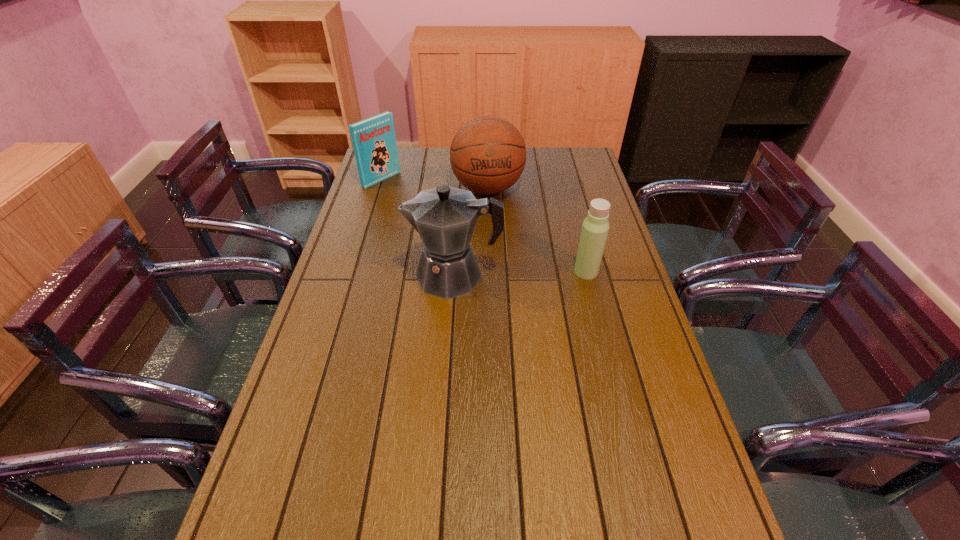
Where is `vacant area at the near edge of the desktop`? This screenshot has height=540, width=960. vacant area at the near edge of the desktop is located at coordinates (375, 493).

In the image, there is a desktop. Where is `blank space at the left edge`? This screenshot has width=960, height=540. blank space at the left edge is located at coordinates (390, 197).

Find the location of a particular element. The width and height of the screenshot is (960, 540). blank area at the right edge is located at coordinates [581, 218].

The width and height of the screenshot is (960, 540). Find the location of `vacant space at the far right corner`. vacant space at the far right corner is located at coordinates (550, 156).

Find the location of a particular element. free space at the near right corner of the desktop is located at coordinates (665, 521).

Identify the location of vacant space in between the rightmost object and the leftmost object. (484, 226).

Identify the location of free space between the thermos bottle and the basketball. This screenshot has height=540, width=960. (537, 230).

Locate an element on the screen. vacant area that lies between the basketball and the leftmost object is located at coordinates (435, 184).

Locate an element on the screen. The height and width of the screenshot is (540, 960). the second closest object to the coffeepot is located at coordinates (487, 155).

Locate an element on the screen. object that can be found as the second closest to the rightmost object is located at coordinates (487, 155).